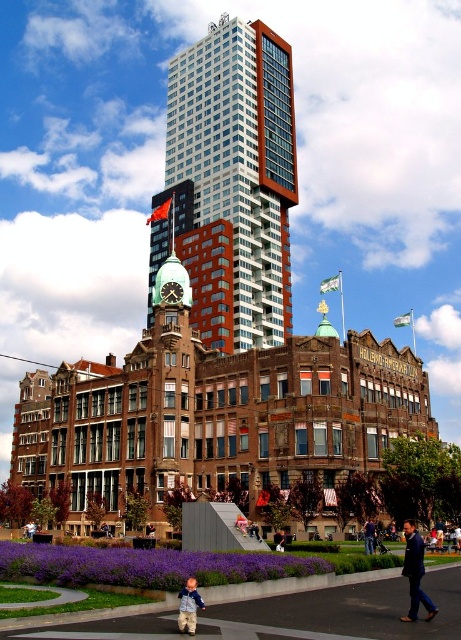
Question: Can you confirm if white glass skyscraper at center is bigger than dark blue jeans at lower center?

Choices:
 (A) yes
 (B) no

Answer: (A)

Question: Which object appears closest to the camera in this image?

Choices:
 (A) dark blue jeans at lower center
 (B) dark blue suit at lower right
 (C) light blue denim jacket at lower center

Answer: (C)

Question: Considering the relative positions of white glass skyscraper at center and dark blue jeans at lower center in the image provided, where is white glass skyscraper at center located with respect to dark blue jeans at lower center?

Choices:
 (A) below
 (B) above

Answer: (B)

Question: Which object is the closest to the light blue denim jacket at lower center?

Choices:
 (A) white glass skyscraper at center
 (B) dark blue jeans at lower center
 (C) dark blue suit at lower right

Answer: (C)

Question: Which point is closer to the camera?

Choices:
 (A) (407, 616)
 (B) (181, 593)
 (C) (212, 346)
 (D) (371, 531)

Answer: (A)

Question: Does dark blue suit at lower right have a smaller size compared to dark blue jeans at lower center?

Choices:
 (A) yes
 (B) no

Answer: (B)